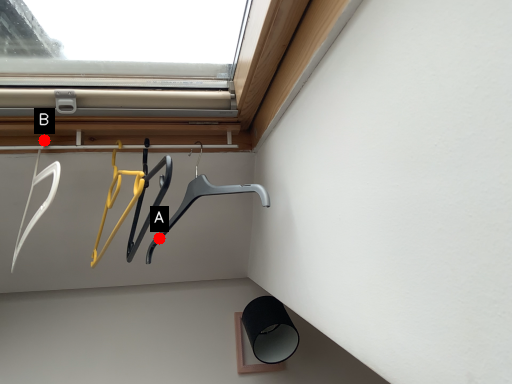
Question: Two points are circled on the image, labeled by A and B beside each circle. Which point is farther from the camera taking this photo?

Choices:
 (A) A is further
 (B) B is further

Answer: (A)